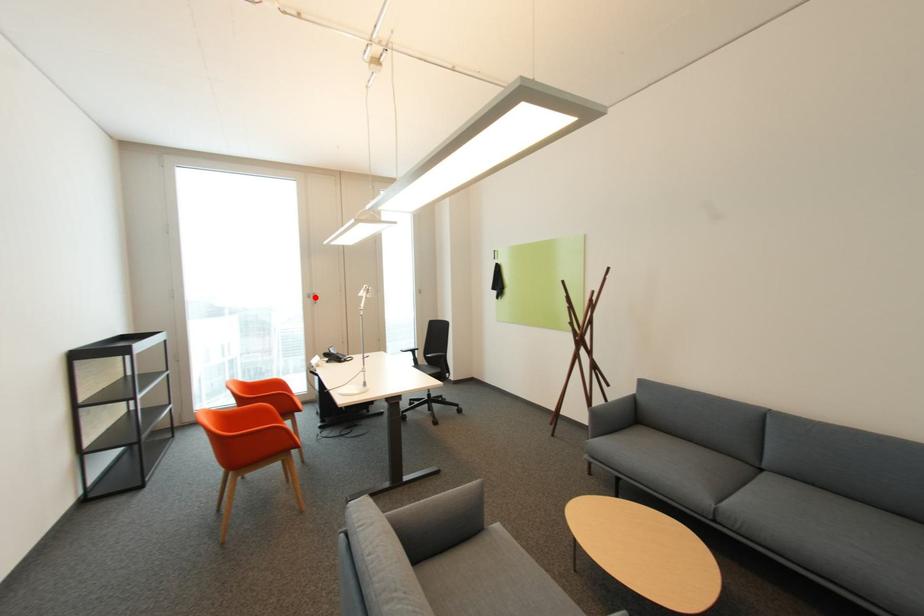
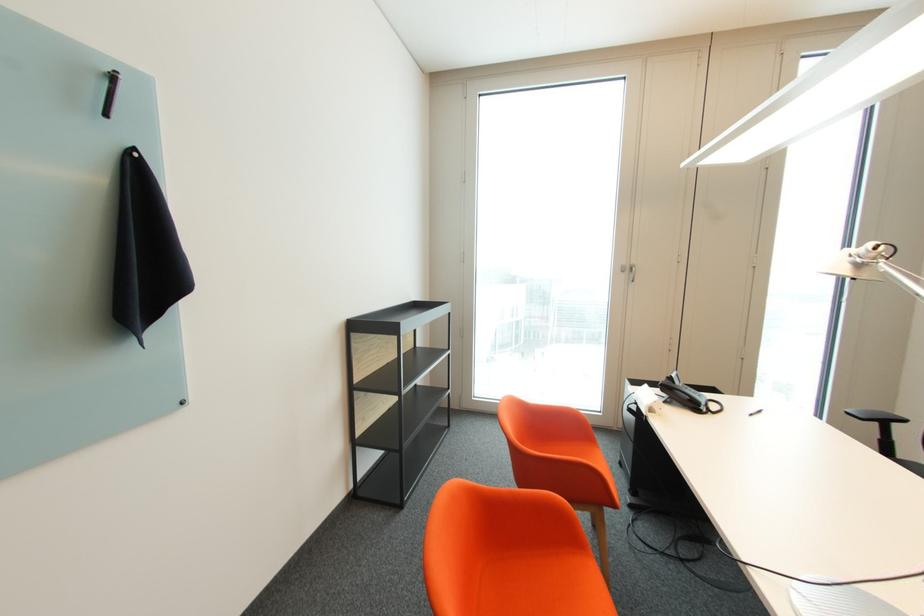
Find the pixel in the second image that matches the highlighted location in the first image.

(629, 272)